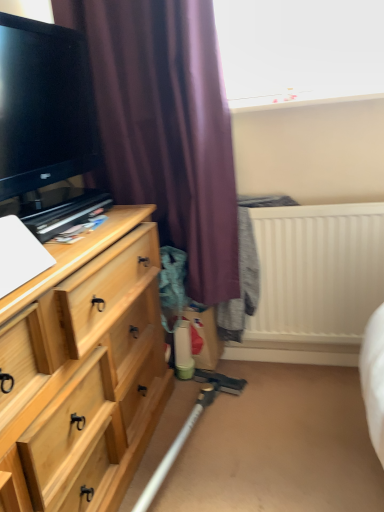
Locate an element on the screen. The image size is (384, 512). empty space that is ontop of white plastic radiator at upper right (from a real-world perspective) is located at coordinates (281, 203).